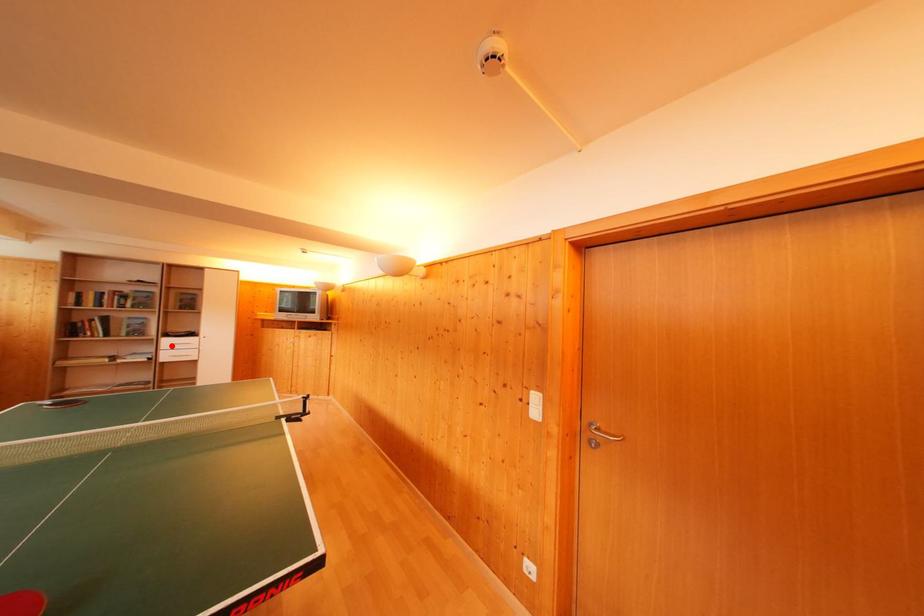
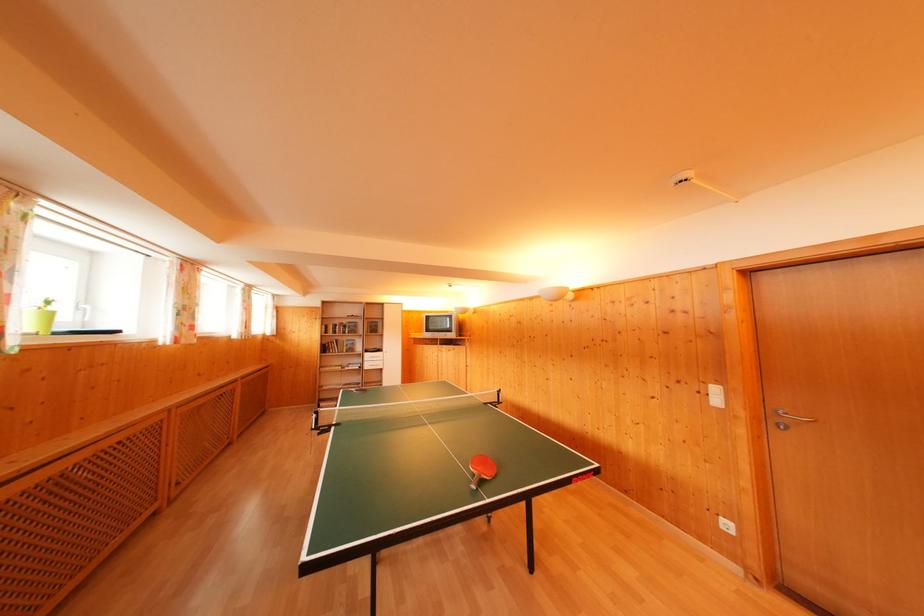
Find the pixel in the second image that matches the highlighted location in the first image.

(371, 360)